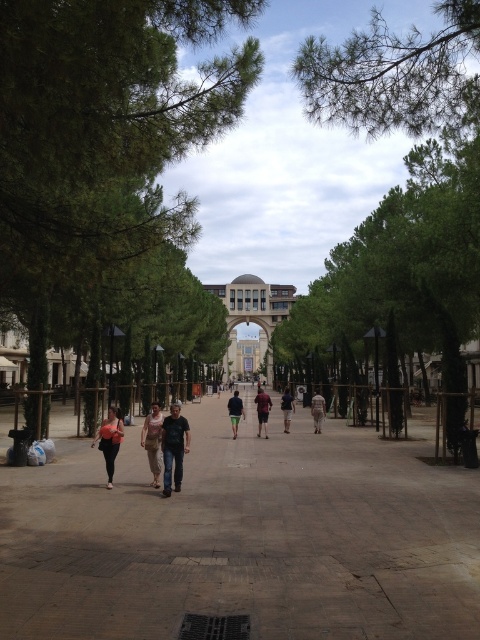
You are standing in the pedestrian plaza and want to reach the point marked at coordinates (x=109, y=474). How far will you have to walk to get there?

The point at coordinates (x=109, y=474) is 56.39 meters away from the viewer, so you will have to walk 56.39 meters to reach it.

You are standing at the center of the pedestrian plaza and notice the brown concrete pavement at lower left. Based on its position, can you determine if it is closer to you or further away compared to the classical building with a dome in the background?

The brown concrete pavement at lower left is located at point coordinates that place it closer to the observer than the classical building with a dome in the background, which is positioned further back in the scene.

Looking at this image, you are a photographer standing at the edge of the plaza, wanting to capture both the matte black pants at lower left and the green fabric pants at center in a single frame. Based on their positions, which direction should you move to ensure both are visible in your shot?

Since the matte black pants at lower left is positioned on the left side of green fabric pants at center, you should move to the right to ensure both are visible in your frame.